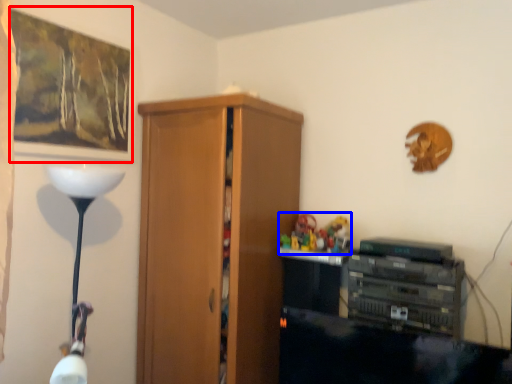
Question: Which of the following is the closest to the observer, picture frame (highlighted by a red box) or toy (highlighted by a blue box)?

Choices:
 (A) picture frame
 (B) toy

Answer: (A)